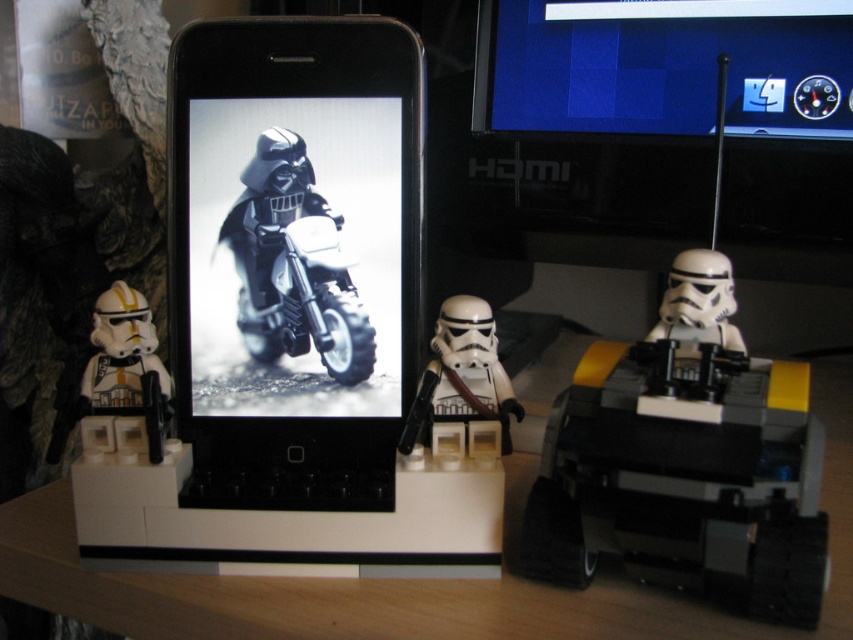
Question: Which object is the farthest from the matte black motorcycle at center?

Choices:
 (A) white plastic stormtrooper at center
 (B) white plastic stormtrooper helmet at center

Answer: (B)

Question: Can you confirm if matte black motorcycle at center is smaller than white plastic stormtrooper at center?

Choices:
 (A) no
 (B) yes

Answer: (B)

Question: Can you confirm if white plastic stormtrooper helmet at center is thinner than matte black motorcycle at center?

Choices:
 (A) no
 (B) yes

Answer: (A)

Question: Which point appears closest to the camera in this image?

Choices:
 (A) (498, 396)
 (B) (677, 259)

Answer: (B)

Question: Is the position of white plastic stormtrooper helmet at center less distant than that of matte black motorcycle at center?

Choices:
 (A) yes
 (B) no

Answer: (A)

Question: Which object is the farthest from the white plastic stormtrooper helmet at center?

Choices:
 (A) matte black motorcycle at center
 (B) white matte stormtrooper helmet at center
 (C) white matte stormtrooper at left

Answer: (C)